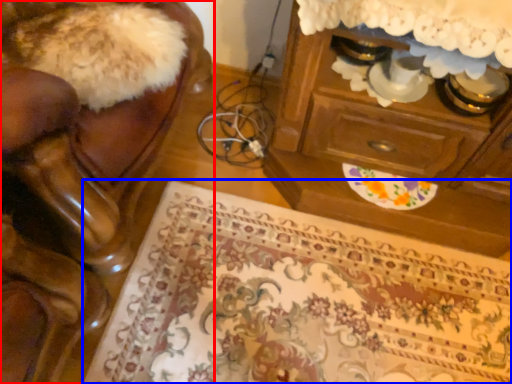
Question: Which object appears farthest to the camera in this image, furniture (highlighted by a red box) or mat (highlighted by a blue box)?

Choices:
 (A) furniture
 (B) mat

Answer: (B)